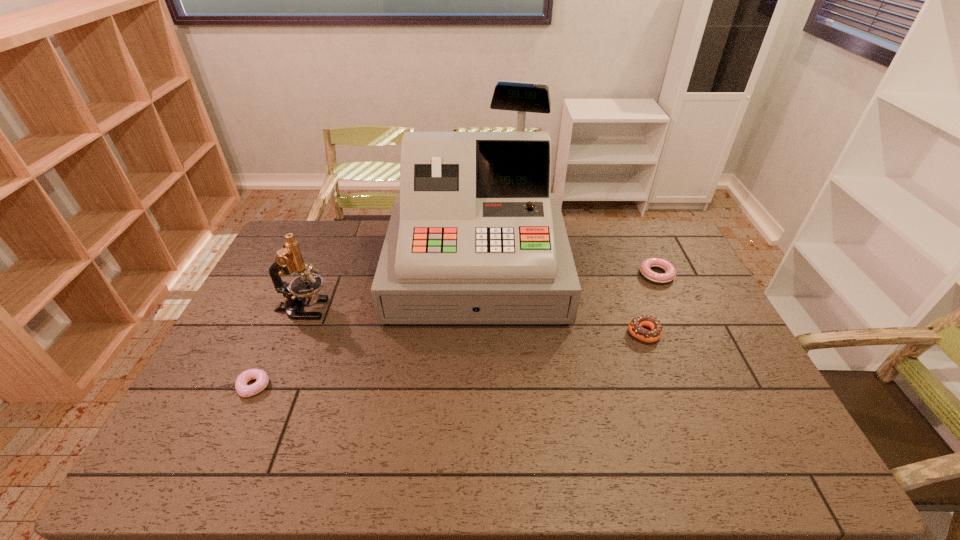
Identify the location of the tallest object. (475, 236).

Where is `cash register`? This screenshot has width=960, height=540. cash register is located at coordinates (475, 236).

The image size is (960, 540). I want to click on the second tallest object, so click(303, 290).

Identify the location of the second doughnut from right to left. This screenshot has width=960, height=540. (635, 327).

This screenshot has height=540, width=960. I want to click on the tallest doughnut, so click(x=635, y=327).

This screenshot has width=960, height=540. I want to click on the rightmost object, so click(647, 273).

Locate an element on the screen. the farthest doughnut is located at coordinates (647, 273).

This screenshot has height=540, width=960. I want to click on the nearest object, so click(x=244, y=390).

Identify the location of the nearest doughnut. pyautogui.click(x=244, y=390).

In order to click on blank space located 0.340m on the keypad side of the tallest object in this screenshot , I will do `click(475, 431)`.